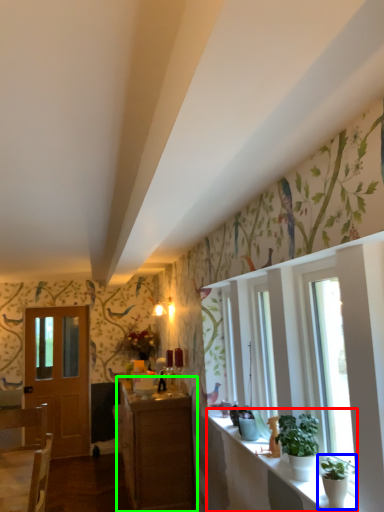
Question: Which object is the farthest from window sill (highlighted by a red box)? Choose among these: houseplant (highlighted by a blue box) or cabinetry (highlighted by a green box).

Choices:
 (A) houseplant
 (B) cabinetry

Answer: (B)